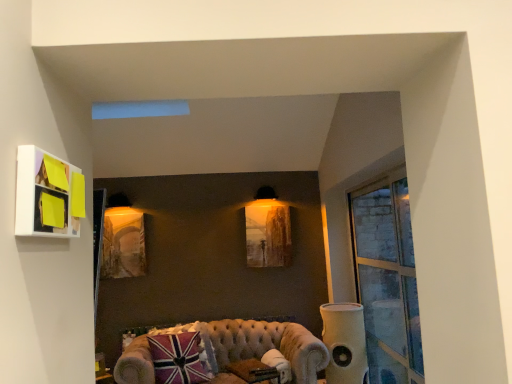
Question: From a real-world perspective, does clear glass window at right stand above matte wooden picture frame at center, the first picture frame positioned from the back?

Choices:
 (A) no
 (B) yes

Answer: (A)

Question: Is clear glass window at right closer to the viewer compared to matte wooden picture frame at center, the first picture frame positioned from the back?

Choices:
 (A) yes
 (B) no

Answer: (A)

Question: Does clear glass window at right touch matte wooden picture frame at center, the first picture frame viewed from the right?

Choices:
 (A) no
 (B) yes

Answer: (A)

Question: From a real-world perspective, is clear glass window at right positioned under matte wooden picture frame at center, positioned as the 3th picture frame in left-to-right order, based on gravity?

Choices:
 (A) no
 (B) yes

Answer: (B)

Question: Does clear glass window at right contain matte wooden picture frame at center, which is counted as the 3th picture frame, starting from the front?

Choices:
 (A) yes
 (B) no

Answer: (B)

Question: Is clear glass window at right situated inside matte white picture frame at upper left, acting as the first picture frame starting from the front, or outside?

Choices:
 (A) outside
 (B) inside

Answer: (A)

Question: Is clear glass window at right bigger or smaller than matte white picture frame at upper left, acting as the first picture frame starting from the front?

Choices:
 (A) big
 (B) small

Answer: (A)

Question: In the image, is clear glass window at right on the left side or the right side of matte white picture frame at upper left, the second picture frame in the right-to-left sequence?

Choices:
 (A) left
 (B) right

Answer: (B)

Question: From a real-world perspective, relative to matte white picture frame at upper left, acting as the first picture frame starting from the front, is clear glass window at right vertically above or below?

Choices:
 (A) above
 (B) below

Answer: (B)

Question: Based on their positions, is matte wooden picture frame at center, the first picture frame positioned from the back, located to the left or right of matte gold picture frame at center, the 2th picture frame viewed from the front?

Choices:
 (A) right
 (B) left

Answer: (A)

Question: Which is correct: matte wooden picture frame at center, which is counted as the 3th picture frame, starting from the front, is inside matte gold picture frame at center, placed as the 3th picture frame when sorted from right to left, or outside of it?

Choices:
 (A) outside
 (B) inside

Answer: (A)

Question: From a real-world perspective, is matte wooden picture frame at center, the first picture frame viewed from the right, physically located above or below matte gold picture frame at center, the 2th picture frame when ordered from back to front?

Choices:
 (A) above
 (B) below

Answer: (A)

Question: Considering the positions of point (272, 205) and point (135, 223), is point (272, 205) closer or farther from the camera than point (135, 223)?

Choices:
 (A) farther
 (B) closer

Answer: (A)

Question: Considering the relative positions of matte white picture frame at upper left, which ranks as the 2th picture frame in left-to-right order, and velvet beige couch at lower center in the image provided, is matte white picture frame at upper left, which ranks as the 2th picture frame in left-to-right order, to the left or to the right of velvet beige couch at lower center?

Choices:
 (A) left
 (B) right

Answer: (A)

Question: Considering the positions of point (74, 198) and point (222, 352), is point (74, 198) closer or farther from the camera than point (222, 352)?

Choices:
 (A) farther
 (B) closer

Answer: (B)